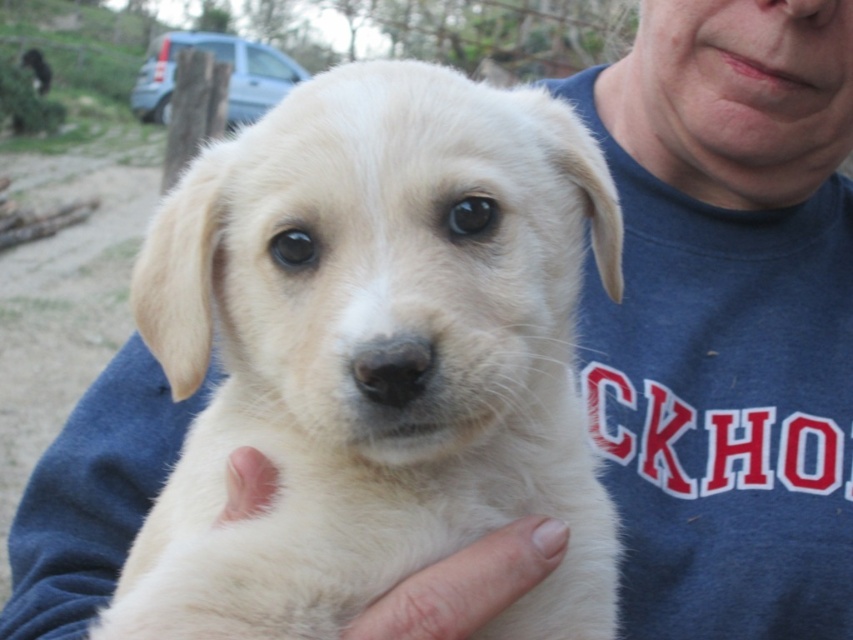
Question: Does white fur dog at center appear under white soft fur at lower center?

Choices:
 (A) no
 (B) yes

Answer: (A)

Question: Does white fur dog at center have a larger size compared to white soft fur at lower center?

Choices:
 (A) no
 (B) yes

Answer: (B)

Question: Which point is closer to the camera?

Choices:
 (A) (461, 557)
 (B) (163, 490)

Answer: (A)

Question: Which point is farther to the camera?

Choices:
 (A) white fur dog at center
 (B) white soft fur at lower center

Answer: (B)

Question: Does white fur dog at center lie behind white soft fur at lower center?

Choices:
 (A) yes
 (B) no

Answer: (B)